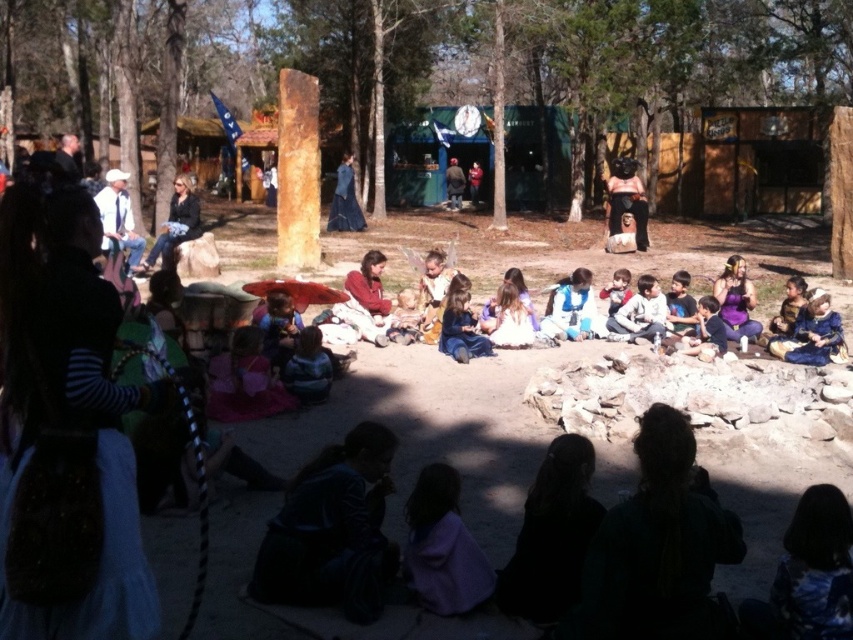
Between point (172, 241) and point (335, 177), which one is positioned in front?

Point (172, 241) is in front.

Between matte black jacket at upper left and matte blue dress at center, which one is positioned higher?

matte blue dress at center is above.

Is point (184, 176) in front of point (339, 212)?

That is True.

Locate an element on the screen. matte black jacket at upper left is located at coordinates (175, 225).

Is point (158, 244) more distant than point (448, 179)?

That is False.

Can you confirm if matte black jacket at upper left is positioned to the right of blue fabric dress at center?

No, matte black jacket at upper left is not to the right of blue fabric dress at center.

Who is more distant from viewer, (160, 241) or (454, 168)?

The point (454, 168) is behind.

What are the coordinates of `matte black jacket at upper left` in the screenshot? It's located at (175, 225).

Which of these two, pink fabric doll at center or matte blue dress at center, stands shorter?

pink fabric doll at center

Measure the distance from pink fabric doll at center to matte blue dress at center.

pink fabric doll at center is 29.38 feet away from matte blue dress at center.

Who is more distant from viewer, (621, 177) or (334, 211)?

Positioned behind is point (334, 211).

Image resolution: width=853 pixels, height=640 pixels. Find the location of `pink fabric doll at center`. pink fabric doll at center is located at coordinates (x=627, y=200).